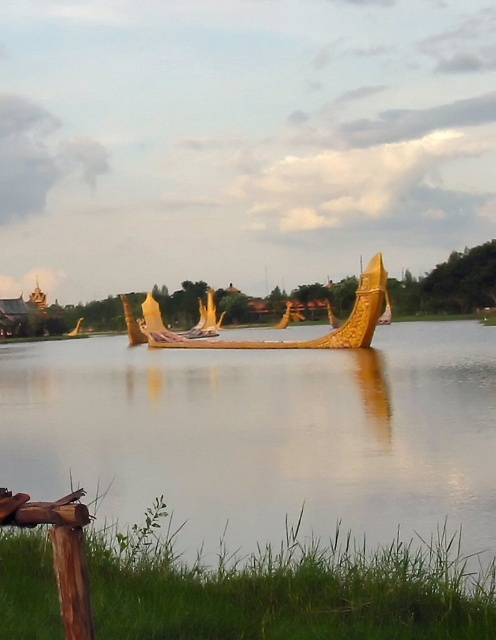
Between smooth gold water at center and gold polished wood boat at center, which one is positioned higher?

gold polished wood boat at center is above.

Which is more to the left, smooth gold water at center or gold polished wood boat at center?

Positioned to the left is smooth gold water at center.

Does point (350, 403) come behind point (376, 264)?

No.

Identify the location of smooth gold water at center. The width and height of the screenshot is (496, 640). (264, 435).